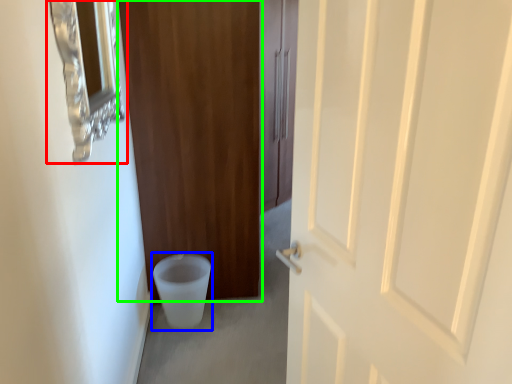
Question: Which object is the closest to the medicine cabinet (highlighted by a red box)? Choose among these: toilet bowl (highlighted by a blue box) or door (highlighted by a green box).

Choices:
 (A) toilet bowl
 (B) door

Answer: (B)